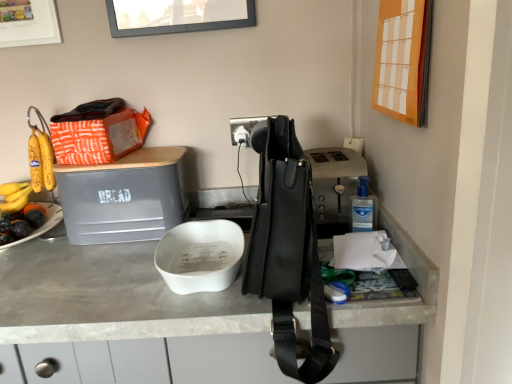
Image resolution: width=512 pixels, height=384 pixels. Describe the element at coordinates (403, 60) in the screenshot. I see `orange paper calendar at upper right, which ranks as the first picture frame in right-to-left order` at that location.

You are a GUI agent. You are given a task and a screenshot of the screen. Output one action in this format:
    pyautogui.click(x=<x>, y=<y>)
    Task: Click on the black leather handbag at center
    This screenshot has width=512, height=384.
    Given the screenshot: What is the action you would take?
    pyautogui.click(x=287, y=249)

What do you see at coordinates (28, 23) in the screenshot?
I see `matte white picture frame at upper left, the first picture frame in the left-to-right sequence` at bounding box center [28, 23].

The width and height of the screenshot is (512, 384). I want to click on white matte bowl at center, so click(x=108, y=298).

At what (x,y) coordinates should I click in order to perform the action: click on black plastic power outlet at center. Please return your answer as a coordinate pair (x, y). Image resolution: width=512 pixels, height=384 pixels. Looking at the image, I should click on (244, 128).

Is black leather handbag at center inside or outside of orange paper calendar at upper right, placed as the 2th picture frame when sorted from back to front?

black leather handbag at center exists outside the volume of orange paper calendar at upper right, placed as the 2th picture frame when sorted from back to front.

Considering the points (310, 185) and (429, 17), which point is behind, point (310, 185) or point (429, 17)?

The point (310, 185) is farther.

Could you tell me if black leather handbag at center is facing orange paper calendar at upper right, positioned as the second picture frame in left-to-right order?

No, black leather handbag at center is not turned towards orange paper calendar at upper right, positioned as the second picture frame in left-to-right order.

The image size is (512, 384). Find the location of `handbag lying on the left of orange paper calendar at upper right, placed as the 2th picture frame when sorted from back to front`. handbag lying on the left of orange paper calendar at upper right, placed as the 2th picture frame when sorted from back to front is located at coordinates (287, 249).

Does gray matte bread bin at upper left have a smaller size compared to black plastic power outlet at center?

No.

Is gray matte bread bin at upper left next to black plastic power outlet at center?

No, gray matte bread bin at upper left is not with black plastic power outlet at center.

Which is behind, gray matte bread bin at upper left or black plastic power outlet at center?

black plastic power outlet at center is more distant.

From the picture: From a real-world perspective, is orange paper calendar at upper right, which ranks as the first picture frame in right-to-left order, physically above black plastic power outlet at center?

Indeed, from a real-world perspective, orange paper calendar at upper right, which ranks as the first picture frame in right-to-left order, stands above black plastic power outlet at center.

Can you confirm if orange paper calendar at upper right, which ranks as the first picture frame in right-to-left order, is positioned to the left of black plastic power outlet at center?

Incorrect, orange paper calendar at upper right, which ranks as the first picture frame in right-to-left order, is not on the left side of black plastic power outlet at center.

Which is closer to the camera, (412, 25) or (248, 136)?

Point (412, 25) is closer to the camera than point (248, 136).

From the picture: From the image's perspective, relative to black plastic power outlet at center, is orange paper calendar at upper right, positioned as the second picture frame in left-to-right order, above or below?

Clearly, from the image's perspective, orange paper calendar at upper right, positioned as the second picture frame in left-to-right order, is above black plastic power outlet at center.

Visually, is black plastic power outlet at center positioned to the left or to the right of white matte bowl at center?

Based on their positions, black plastic power outlet at center is located to the right of white matte bowl at center.

Which is more distant, (232, 119) or (177, 333)?

The point (232, 119) is more distant.

From a real-world perspective, who is located lower, black plastic power outlet at center or white matte bowl at center?

white matte bowl at center.

Which of these two, black plastic power outlet at center or white matte bowl at center, is thinner?

black plastic power outlet at center is thinner.

Considering the sizes of objects black leather handbag at center and gray matte bread bin at upper left in the image provided, who is shorter, black leather handbag at center or gray matte bread bin at upper left?

gray matte bread bin at upper left.

Consider the image. From the image's perspective, is black leather handbag at center over gray matte bread bin at upper left?

No, from the image's perspective, black leather handbag at center is not above gray matte bread bin at upper left.

Is black leather handbag at center bigger than gray matte bread bin at upper left?

Correct, black leather handbag at center is larger in size than gray matte bread bin at upper left.

From a real-world perspective, between matte white picture frame at upper left, the 2th picture frame in the front-to-back sequence, and white matte bowl at center, who is vertically lower?

From a 3D spatial view, white matte bowl at center is below.

Who is taller, matte white picture frame at upper left, which is counted as the first picture frame, starting from the back, or white matte bowl at center?

white matte bowl at center is taller.

Is matte white picture frame at upper left, the 2th picture frame when ordered from right to left, inside or outside of white matte bowl at center?

matte white picture frame at upper left, the 2th picture frame when ordered from right to left, is outside white matte bowl at center.

Is gray matte bread bin at upper left inside orange paper calendar at upper right, positioned as the second picture frame in left-to-right order?

No, gray matte bread bin at upper left is not a part of orange paper calendar at upper right, positioned as the second picture frame in left-to-right order.

Is orange paper calendar at upper right, the first picture frame in the bottom-to-top sequence, next to gray matte bread bin at upper left?

No, orange paper calendar at upper right, the first picture frame in the bottom-to-top sequence, is not making contact with gray matte bread bin at upper left.

Is orange paper calendar at upper right, which appears as the 1th picture frame when viewed from the front, wider or thinner than gray matte bread bin at upper left?

Clearly, orange paper calendar at upper right, which appears as the 1th picture frame when viewed from the front, has less width compared to gray matte bread bin at upper left.

Based on the photo, is orange paper calendar at upper right, which ranks as the first picture frame in right-to-left order, to the left or to the right of gray matte bread bin at upper left in the image?

orange paper calendar at upper right, which ranks as the first picture frame in right-to-left order, is positioned on gray matte bread bin at upper left's right side.

From a real-world perspective, count 1st picture frames upward from the black leather handbag at center and point to it. Please provide its 2D coordinates.

[(403, 60)]

Where is `wide that is in front of the black plastic power outlet at center`? This screenshot has height=384, width=512. wide that is in front of the black plastic power outlet at center is located at coordinates (124, 197).

Which object lies further to the anchor point gray matte bread bin at upper left, matte white picture frame at upper left, the first picture frame in the left-to-right sequence, or orange paper calendar at upper right, which ranks as the first picture frame in right-to-left order?

orange paper calendar at upper right, which ranks as the first picture frame in right-to-left order, is further to gray matte bread bin at upper left.

Estimate the real-world distances between objects in this image. Which object is further from black leather handbag at center, black plastic power outlet at center or matte white picture frame at upper left, the 2th picture frame in the front-to-back sequence?

matte white picture frame at upper left, the 2th picture frame in the front-to-back sequence, lies further to black leather handbag at center than the other object.

Which object lies nearer to the anchor point matte white picture frame at upper left, the 2th picture frame when ordered from right to left, orange paper calendar at upper right, positioned as the second picture frame in left-to-right order, or gray matte bread bin at upper left?

Among the two, gray matte bread bin at upper left is located nearer to matte white picture frame at upper left, the 2th picture frame when ordered from right to left.

Based on their spatial positions, is black plastic power outlet at center or orange paper calendar at upper right, placed as the 2th picture frame when sorted from back to front, further from black leather handbag at center?

The object further to black leather handbag at center is black plastic power outlet at center.

Looking at the image, which one is located further to black leather handbag at center, orange paper calendar at upper right, which ranks as the second picture frame in top-to-bottom order, or matte white picture frame at upper left, which ranks as the second picture frame in bottom-to-top order?

Among the two, matte white picture frame at upper left, which ranks as the second picture frame in bottom-to-top order, is located further to black leather handbag at center.

When comparing their distances from white matte bowl at center, does matte white picture frame at upper left, the 2th picture frame when ordered from right to left, or black plastic power outlet at center seem closer?

black plastic power outlet at center lies closer to white matte bowl at center than the other object.

Which object lies further to the anchor point black plastic power outlet at center, gray matte bread bin at upper left or black leather handbag at center?

Based on the image, black leather handbag at center appears to be further to black plastic power outlet at center.

Based on their spatial positions, is matte white picture frame at upper left, the first picture frame in the top-to-bottom sequence, or gray matte bread bin at upper left closer to black leather handbag at center?

gray matte bread bin at upper left.

Identify the location of wide located between matte white picture frame at upper left, the 2th picture frame when ordered from right to left, and black leather handbag at center in the left-right direction. Image resolution: width=512 pixels, height=384 pixels. (124, 197).

Where is `power outlet between orange paper calendar at upper right, which appears as the 1th picture frame when viewed from the front, and white matte bowl at center in the up-down direction`? The height and width of the screenshot is (384, 512). power outlet between orange paper calendar at upper right, which appears as the 1th picture frame when viewed from the front, and white matte bowl at center in the up-down direction is located at coordinates (244, 128).

Find the location of a particular element. This screenshot has width=512, height=384. wide located between black leather handbag at center and black plastic power outlet at center in the depth direction is located at coordinates coord(124,197).

This screenshot has width=512, height=384. In order to click on picture frame between matte white picture frame at upper left, the 2th picture frame when ordered from right to left, and white matte bowl at center in the up-down direction in this screenshot , I will do `click(403, 60)`.